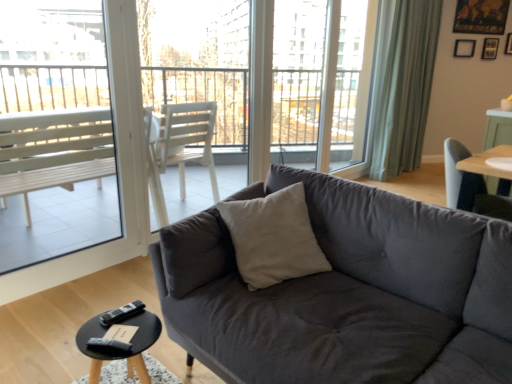
Describe the element at coordinates (109, 344) in the screenshot. I see `black plastic remote at lower left, marked as the first remote in a bottom-to-top arrangement` at that location.

Describe the element at coordinates (117, 349) in the screenshot. I see `black wood coffee table at lower left` at that location.

Find the location of `black wood coffee table at lower left`. black wood coffee table at lower left is located at coordinates (117, 349).

Identify the location of wooden picture frame at upper right, which is counted as the 2th picture frame, starting from the left. Image resolution: width=512 pixels, height=384 pixels. (490, 48).

Image resolution: width=512 pixels, height=384 pixels. I want to click on beige textured pillow at center, so click(x=273, y=237).

The image size is (512, 384). What do you see at coordinates (273, 237) in the screenshot?
I see `beige textured pillow at center` at bounding box center [273, 237].

Locate an element on the screen. This screenshot has height=384, width=512. dark gray fabric couch at center is located at coordinates (347, 294).

From the image's perspective, which object appears higher, black plastic remote at lower left, marked as the first remote in a bottom-to-top arrangement, or black wood coffee table at lower left?

black plastic remote at lower left, marked as the first remote in a bottom-to-top arrangement.

Looking at the image, does black plastic remote at lower left, the first remote from the front, seem bigger or smaller compared to black wood coffee table at lower left?

black plastic remote at lower left, the first remote from the front, is smaller than black wood coffee table at lower left.

Would you say black plastic remote at lower left, marked as the first remote in a bottom-to-top arrangement, is to the left or to the right of black wood coffee table at lower left in the picture?

black plastic remote at lower left, marked as the first remote in a bottom-to-top arrangement, is positioned on black wood coffee table at lower left's right side.

Is black plastic remote at lower left, the first remote from the front, inside or outside of black wood coffee table at lower left?

The correct answer is: inside.

Considering the sizes of objects black plastic remote at lower left, the first remote in the back-to-front sequence, and black matte picture frame at upper right, the 2th picture frame viewed from the right, in the image provided, who is thinner, black plastic remote at lower left, the first remote in the back-to-front sequence, or black matte picture frame at upper right, the 2th picture frame viewed from the right,?

With smaller width is black matte picture frame at upper right, the 2th picture frame viewed from the right.

Is black plastic remote at lower left, which appears as the 1th remote when viewed from the top, looking in the opposite direction of black matte picture frame at upper right, the 2th picture frame viewed from the right?

No, black plastic remote at lower left, which appears as the 1th remote when viewed from the top, is not facing away from black matte picture frame at upper right, the 2th picture frame viewed from the right.

Where is `the 1st remote directly beneath the black matte picture frame at upper right, the 2th picture frame viewed from the right (from a real-world perspective)`? The image size is (512, 384). the 1st remote directly beneath the black matte picture frame at upper right, the 2th picture frame viewed from the right (from a real-world perspective) is located at coordinates (121, 313).

Starting from the dark gray fabric couch at center, which window screen is the 1st one behind? Please provide its 2D coordinates.

[(52, 56)]

Who is shorter, dark gray fabric couch at center or white plastic bench at left, marked as the first window screen in a left-to-right arrangement?

With less height is dark gray fabric couch at center.

From a real-world perspective, is dark gray fabric couch at center positioned over white plastic bench at left, the second window screen from the right, based on gravity?

No, from a real-world perspective, dark gray fabric couch at center is not on top of white plastic bench at left, the second window screen from the right.

Is the position of dark gray fabric couch at center less distant than that of white plastic bench at left, marked as the first window screen in a left-to-right arrangement?

Yes, dark gray fabric couch at center is in front of white plastic bench at left, marked as the first window screen in a left-to-right arrangement.

From the image's perspective, does beige textured pillow at center appear higher than dark gray fabric couch at center?

Yes.

From a real-world perspective, which is physically above, beige textured pillow at center or dark gray fabric couch at center?

beige textured pillow at center is physically above.

Looking at this image, considering the relative sizes of beige textured pillow at center and dark gray fabric couch at center in the image provided, is beige textured pillow at center shorter than dark gray fabric couch at center?

Yes.

Which of these two, white plastic bench at left, the second window screen from the right, or transparent glass screen door at upper center, stands taller?

transparent glass screen door at upper center.

From a real-world perspective, who is located higher, white plastic bench at left, the second window screen from the right, or transparent glass screen door at upper center?

transparent glass screen door at upper center is physically above.

Could you tell me if white plastic bench at left, the second window screen from the right, is facing transparent glass screen door at upper center?

No.

Consider the image. In the image, is wooden picture frame at upper right, the 1th picture frame in the right-to-left sequence, positioned in front of or behind black matte picture frame at upper right, the 2th picture frame viewed from the right?

wooden picture frame at upper right, the 1th picture frame in the right-to-left sequence, is positioned farther from the viewer than black matte picture frame at upper right, the 2th picture frame viewed from the right.

From the image's perspective, between wooden picture frame at upper right, which is counted as the 2th picture frame, starting from the left, and black matte picture frame at upper right, marked as the 1th picture frame in a left-to-right arrangement, which one is located above?

wooden picture frame at upper right, which is counted as the 2th picture frame, starting from the left, from the image's perspective.

What's the angular difference between wooden picture frame at upper right, the 1th picture frame in the right-to-left sequence, and black matte picture frame at upper right, marked as the 1th picture frame in a left-to-right arrangement,'s facing directions?

They differ by 0.427 degrees in their facing directions.

From a real-world perspective, relative to black wood coffee table at lower left, is beige textured pillow at center vertically above or below?

beige textured pillow at center is situated higher than black wood coffee table at lower left in the real world.

Who is bigger, beige textured pillow at center or black wood coffee table at lower left?

beige textured pillow at center is bigger.

Considering the sizes of objects beige textured pillow at center and black wood coffee table at lower left in the image provided, who is thinner, beige textured pillow at center or black wood coffee table at lower left?

beige textured pillow at center.

Which object is further away from the camera taking this photo, beige textured pillow at center or black wood coffee table at lower left?

beige textured pillow at center is behind.

The height and width of the screenshot is (384, 512). I want to click on coffee table below the black plastic remote at lower left, which is the second remote from top to bottom (from a real-world perspective), so click(117, 349).

From the image's perspective, count 1st remotes downward from the black matte picture frame at upper right, marked as the 1th picture frame in a left-to-right arrangement, and point to it. Please provide its 2D coordinates.

[(121, 313)]

Considering their positions, is white plastic chair at upper center, the 1th window screen when ordered from right to left, positioned closer to wooden picture frame at upper right, the 1th picture frame in the right-to-left sequence, than black plastic remote at lower left, which appears as the 1th remote when viewed from the top?

white plastic chair at upper center, the 1th window screen when ordered from right to left, is positioned closer to the anchor wooden picture frame at upper right, the 1th picture frame in the right-to-left sequence.

From the image, which object appears to be nearer to white plastic bench at left, marked as the first window screen in a left-to-right arrangement, black matte picture frame at upper right, the 2th picture frame viewed from the right, or dark gray fabric couch at center?

The object closer to white plastic bench at left, marked as the first window screen in a left-to-right arrangement, is dark gray fabric couch at center.

When comparing their distances from wooden picture frame at upper right, the 1th picture frame in the right-to-left sequence, does light blue fabric chair at right or transparent glass screen door at upper center seem further?

The object further to wooden picture frame at upper right, the 1th picture frame in the right-to-left sequence, is light blue fabric chair at right.

Which object lies further to the anchor point green fabric curtain at upper right, beige textured pillow at center or black wood coffee table at lower left?

black wood coffee table at lower left.

Estimate the real-world distances between objects in this image. Which object is further from wooden picture frame at upper right, which is counted as the 2th picture frame, starting from the left, green fabric curtain at upper right or light blue fabric chair at right?

Among the two, light blue fabric chair at right is located further to wooden picture frame at upper right, which is counted as the 2th picture frame, starting from the left.

Based on their spatial positions, is black matte picture frame at upper right, marked as the 1th picture frame in a left-to-right arrangement, or transparent glass screen door at upper center further from beige textured pillow at center?

black matte picture frame at upper right, marked as the 1th picture frame in a left-to-right arrangement, is further to beige textured pillow at center.

Considering their positions, is transparent glass screen door at upper center positioned further to beige textured pillow at center than black wood coffee table at lower left?

The object further to beige textured pillow at center is transparent glass screen door at upper center.

When comparing their distances from wooden picture frame at upper right, the 1th picture frame in the right-to-left sequence, does black plastic remote at lower left, the first remote from the front, or white plastic bench at left, marked as the first window screen in a left-to-right arrangement, seem closer?

white plastic bench at left, marked as the first window screen in a left-to-right arrangement, is positioned closer to the anchor wooden picture frame at upper right, the 1th picture frame in the right-to-left sequence.

This screenshot has height=384, width=512. What are the coordinates of `chair located between black plastic remote at lower left, marked as the first remote in a bottom-to-top arrangement, and green fabric curtain at upper right in the depth direction` in the screenshot? It's located at (472, 186).

Where is `coffee table between dark gray fabric couch at center and black matte picture frame at upper right, the 2th picture frame viewed from the right, along the z-axis`? The height and width of the screenshot is (384, 512). coffee table between dark gray fabric couch at center and black matte picture frame at upper right, the 2th picture frame viewed from the right, along the z-axis is located at coordinates (117, 349).

I want to click on chair positioned between black plastic remote at lower left, which appears as the 1th remote when viewed from the top, and wooden picture frame at upper right, which is counted as the 2th picture frame, starting from the left, from near to far, so click(x=472, y=186).

At what (x,y) coordinates should I click in order to perform the action: click on picture frame positioned between black wood coffee table at lower left and wooden picture frame at upper right, the 1th picture frame in the right-to-left sequence, from near to far. Please return your answer as a coordinate pair (x, y). Image resolution: width=512 pixels, height=384 pixels. Looking at the image, I should click on (464, 48).